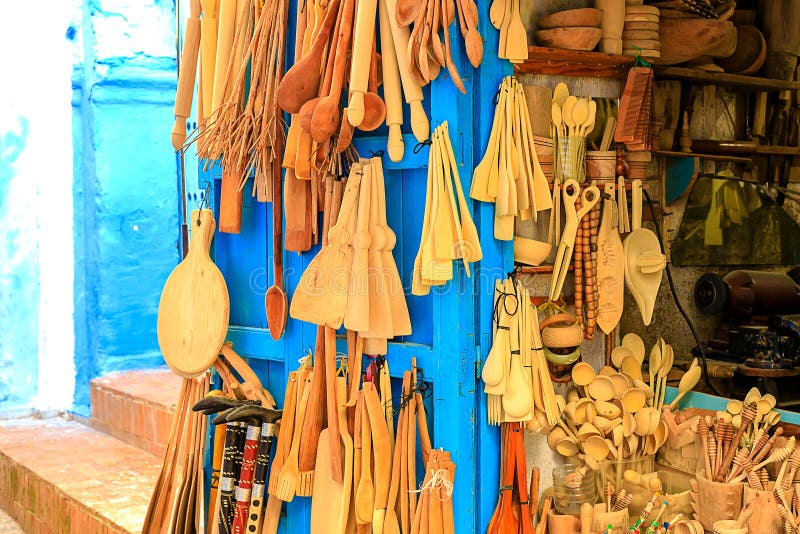
Identify the location of wall. This screenshot has height=534, width=800. (98, 188).